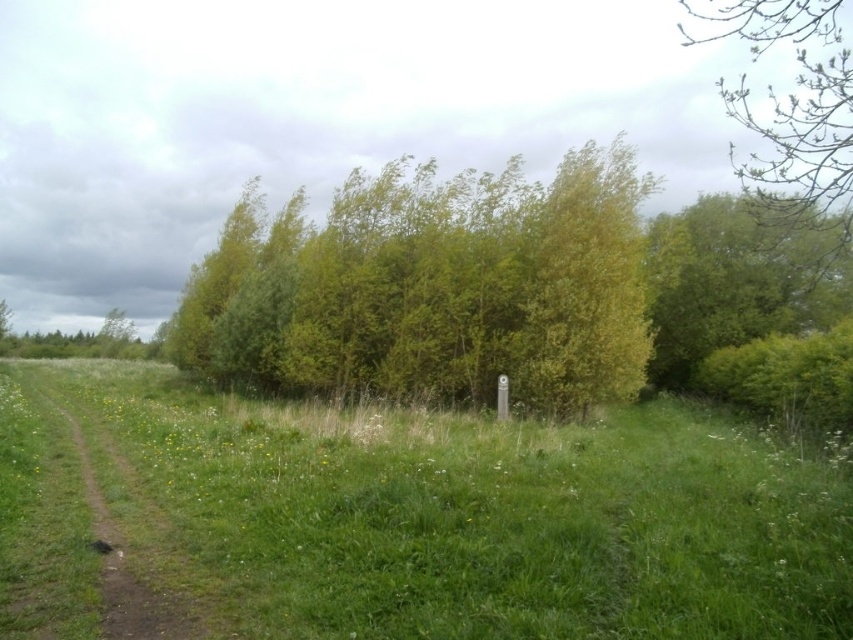
You are a hiker who wants to reach the green leafy tree at upper right from the brown dirt track at left. Which direction should you head towards?

The brown dirt track at left is positioned on the left side of green leafy tree at upper right, so you should head towards the right direction to reach the green leafy tree at upper right from the brown dirt track at left.

You are a hiker who wants to place a 12 meter long tent between the green grassy field at center and the green leafy tree at upper right. Will the tent fit without overlapping either of them?

The distance between the green grassy field at center and the green leafy tree at upper right is 10.86 meters. Since the tent is 12 meters long, it will not fit as the available space is shorter than the tent.

Based on the scene description, where is the green grassy field at center located in terms of coordinates?

The green grassy field at center is located at coordinates point (410, 516).